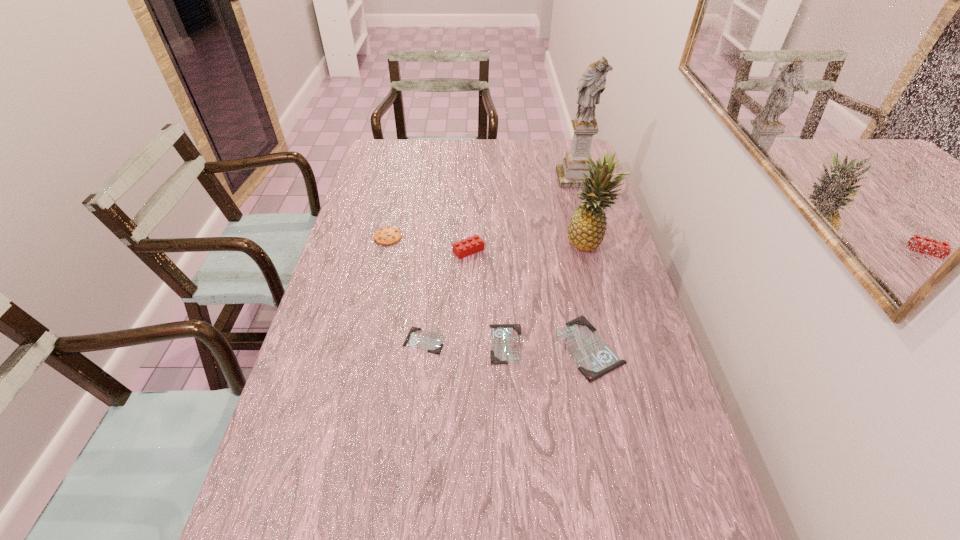
Find the location of a particular element. the shortest identity card is located at coordinates (430, 341).

In order to click on the sixth object from right to left in this screenshot , I will do `click(430, 341)`.

Where is `the second shortest identity card`? the second shortest identity card is located at coordinates (506, 347).

The width and height of the screenshot is (960, 540). In order to click on the second identity card from right to left in this screenshot , I will do `click(506, 347)`.

Where is `the rightmost identity card`? This screenshot has width=960, height=540. the rightmost identity card is located at coordinates (595, 358).

The width and height of the screenshot is (960, 540). In order to click on the tallest identity card in this screenshot , I will do `click(595, 358)`.

Locate an element on the screen. This screenshot has width=960, height=540. sculpture is located at coordinates (592, 83).

You are a GUI agent. You are given a task and a screenshot of the screen. Output one action in this format:
    pyautogui.click(x=<x>, y=<y>)
    Task: Click on the tallest object
    
    Given the screenshot: What is the action you would take?
    pyautogui.click(x=592, y=83)

Find the location of a particular element. This screenshot has width=960, height=540. the leftmost object is located at coordinates (387, 235).

This screenshot has width=960, height=540. In order to click on the fourth tallest object in this screenshot , I will do `click(387, 235)`.